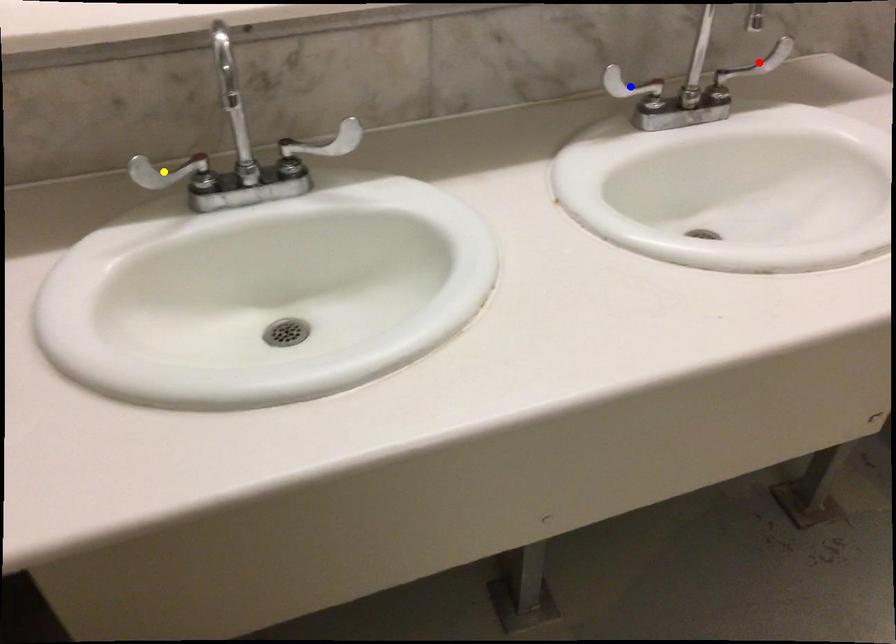
Order these from nearest to farthest:
yellow point
red point
blue point

yellow point, blue point, red point